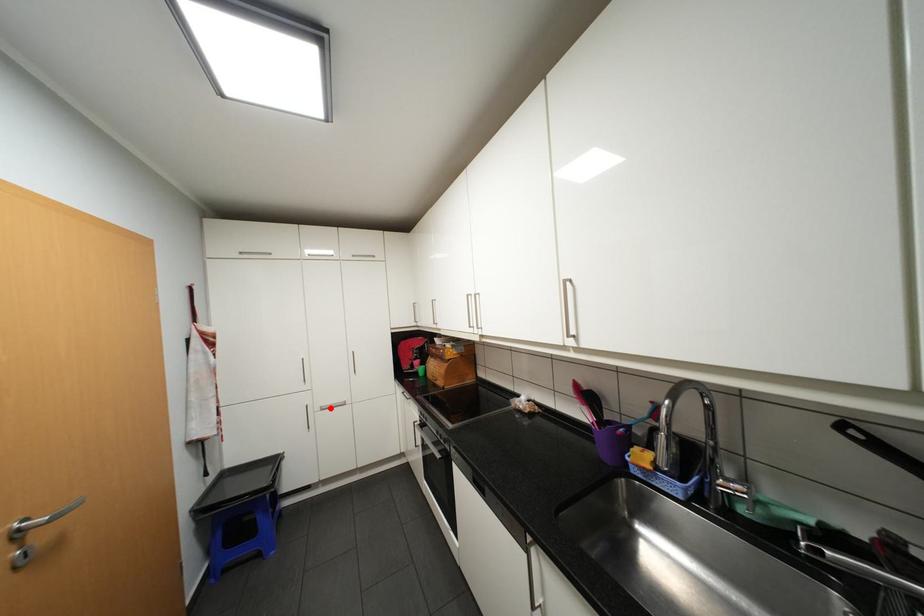
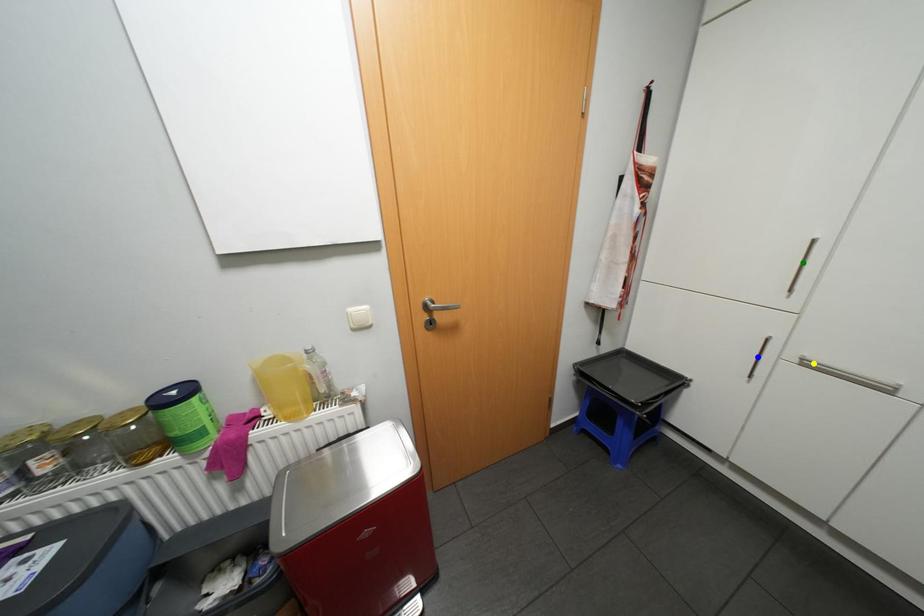
Question: I am providing you with two images of the same scene from different viewpoints. A red point is marked on the first image. You are given multiple points on the second image. In image 2, which mark is for the same physical point as the one in image 1?

Choices:
 (A) yellow point
 (B) blue point
 (C) green point

Answer: (A)